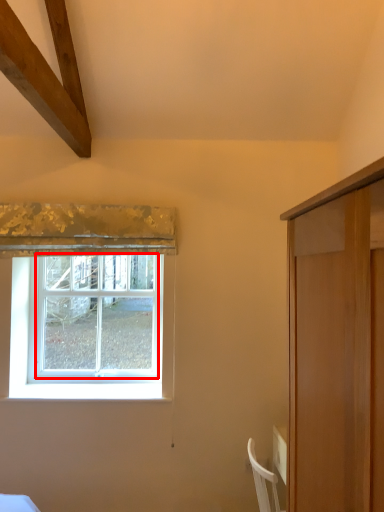
Question: From the image's perspective, where is window (annotated by the red box) located in relation to curtain in the image?

Choices:
 (A) above
 (B) below

Answer: (B)